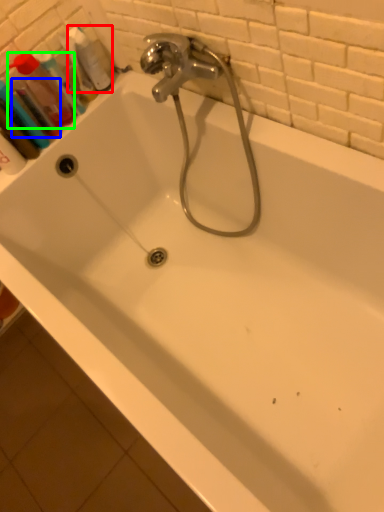
Question: Considering the real-world distances, which object is closest to cleaning product (highlighted by a red box)? mouthwash (highlighted by a blue box) or mouthwash (highlighted by a green box).

Choices:
 (A) mouthwash
 (B) mouthwash

Answer: (B)